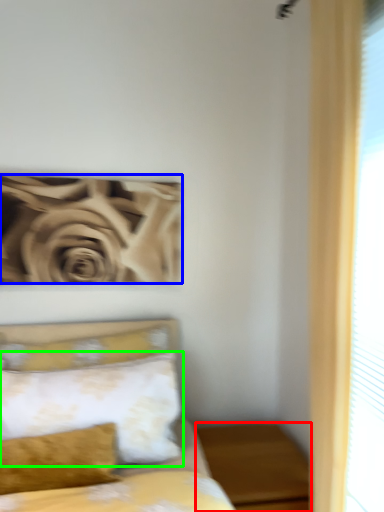
Question: Based on their relative distances, which object is farther from nightstand (highlighted by a red box)? Choose from rose (highlighted by a blue box) and pillow (highlighted by a green box).

Choices:
 (A) rose
 (B) pillow

Answer: (A)